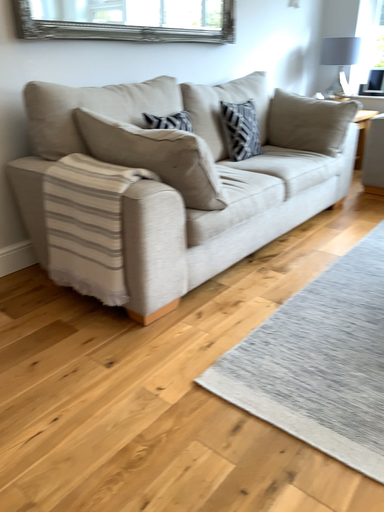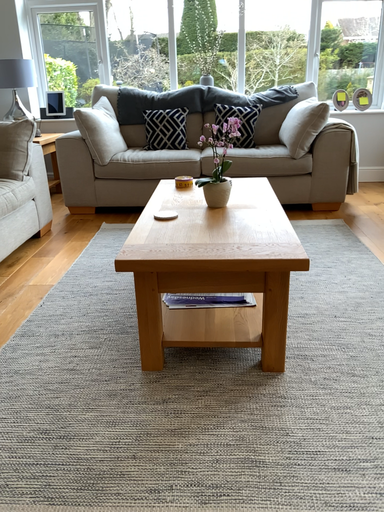
Question: Which way did the camera rotate in the video?

Choices:
 (A) rotated downward
 (B) rotated upward

Answer: (B)